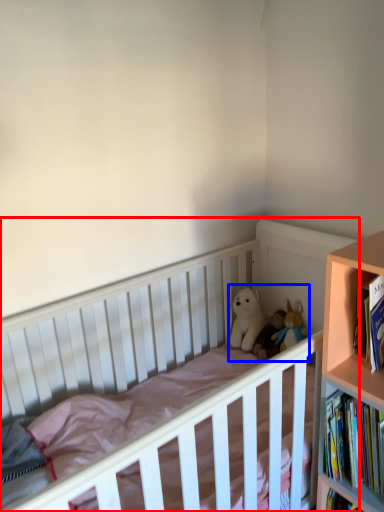
Question: Which of the following is the farthest to the observer, infant bed (highlighted by a red box) or toy (highlighted by a blue box)?

Choices:
 (A) infant bed
 (B) toy

Answer: (B)